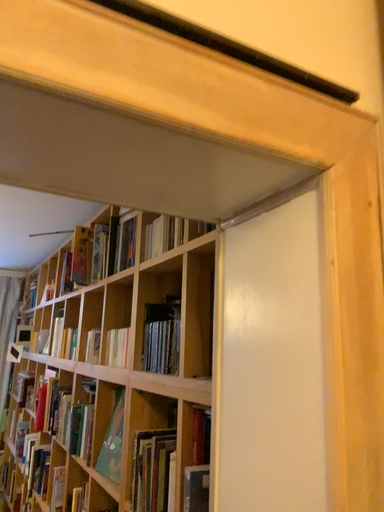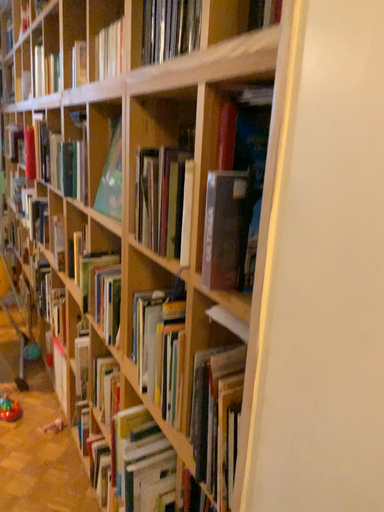
Question: Which way did the camera rotate in the video?

Choices:
 (A) rotated downward
 (B) rotated upward

Answer: (A)